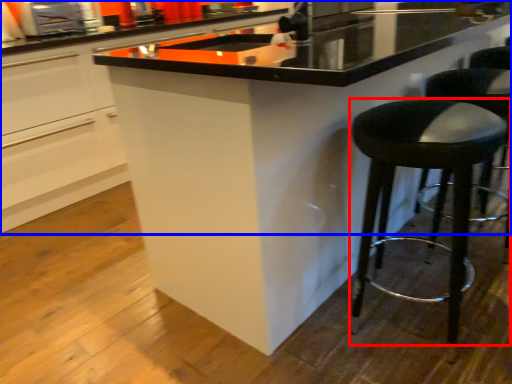
Question: Which object appears closest to the camera in this image, stool (highlighted by a red box) or cabinetry (highlighted by a blue box)?

Choices:
 (A) stool
 (B) cabinetry

Answer: (A)